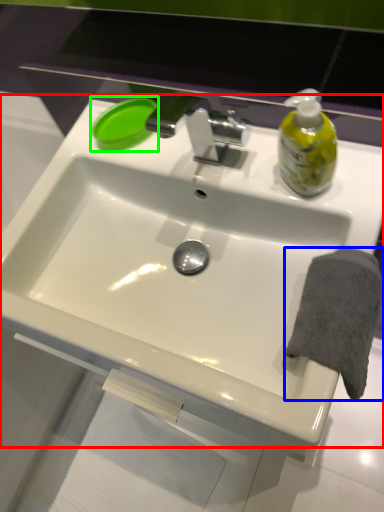
Question: Which is farther away from sink (highlighted by a red box)? bath towel (highlighted by a blue box) or soap (highlighted by a green box)?

Choices:
 (A) bath towel
 (B) soap

Answer: (B)